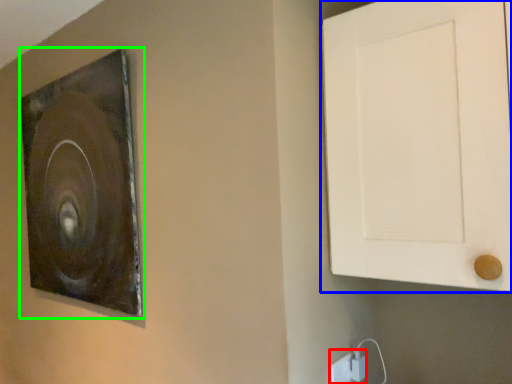
Question: Which is farther away from electric outlet (highlighted by a red box)? door (highlighted by a blue box) or picture frame (highlighted by a green box)?

Choices:
 (A) door
 (B) picture frame

Answer: (B)